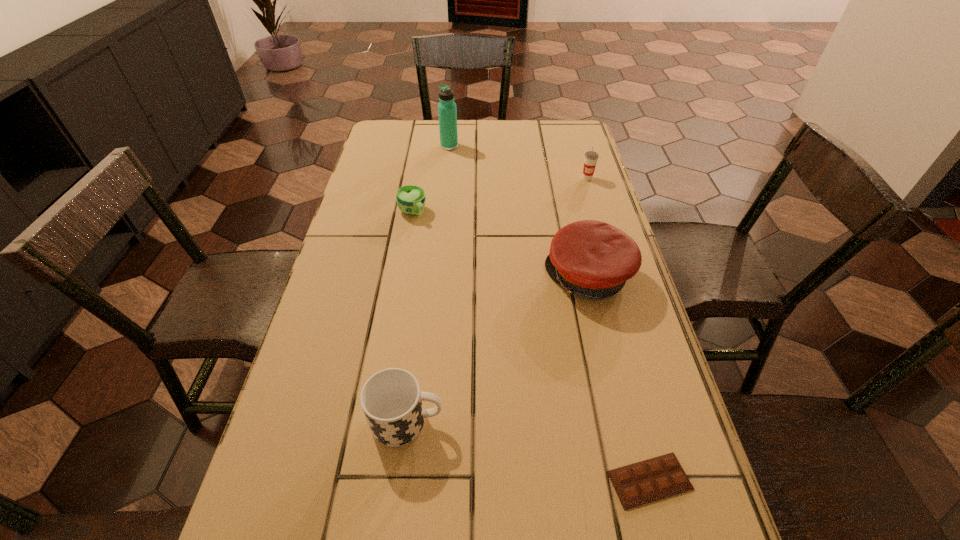
Locate an element on the screen. the farthest object is located at coordinates (447, 111).

Locate an element on the screen. The width and height of the screenshot is (960, 540). thermos bottle is located at coordinates pos(447,111).

Where is `the fifth nearest object`? The height and width of the screenshot is (540, 960). the fifth nearest object is located at coordinates (591, 157).

The width and height of the screenshot is (960, 540). Find the location of `the rightmost cup`. the rightmost cup is located at coordinates (591, 157).

I want to click on cap, so click(593, 259).

You are a GUI agent. You are given a task and a screenshot of the screen. Output one action in this format:
    pyautogui.click(x=<x>, y=<y>)
    Task: Click on the fifth farthest object
    Image resolution: width=960 pixels, height=540 pixels.
    Given the screenshot: What is the action you would take?
    pyautogui.click(x=391, y=399)

Where is `the shortest cup`? The height and width of the screenshot is (540, 960). the shortest cup is located at coordinates (410, 199).

Where is `the second shortest object`? the second shortest object is located at coordinates (410, 199).

Where is `the shortest object`? This screenshot has width=960, height=540. the shortest object is located at coordinates (640, 483).

Where is `the nearest object`? the nearest object is located at coordinates (640, 483).